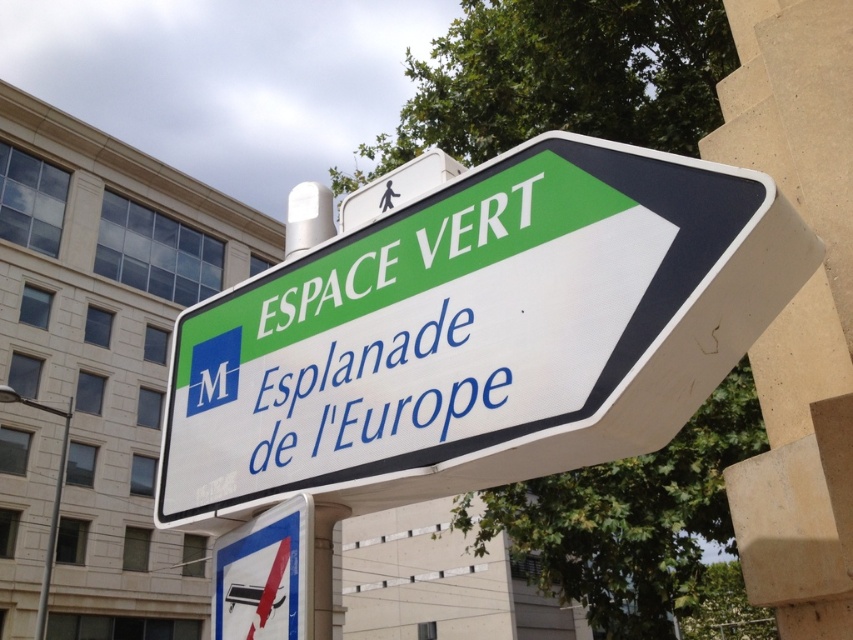
You are a tourist holding a map and looking at the white plastic sign at center and the white plastic sign at upper center. Which one is taller?

The white plastic sign at center is taller than the white plastic sign at upper center.

You are standing in front of a sign that has two parts, a white plastic sign at center and a white paper sign at center. If you want to read both signs clearly, which one should you look at first to ensure you can see all the information without moving your head?

Since the white plastic sign at center and white paper sign at center are only 10.03 centimeters apart from each other, you can easily read both without moving your head. However, since the white paper sign at center might be placed in front, you should look at it first to avoid obstruction.

You are a delivery person holding a package that needs to be placed on the white plastic sign at center. Considering your arm reaches 1.4 meters, can you place the package on the sign without moving closer?

The white plastic sign at center is 1.45 meters away from the viewer. Since your arm only reaches 1.4 meters, you cannot place the package on the sign without moving closer.